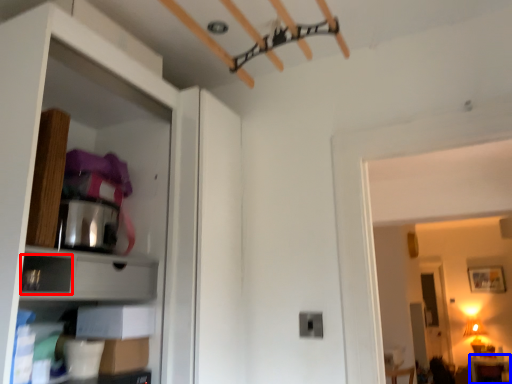
Question: Which point is closer to the camera, drawer (highlighted by a red box) or furniture (highlighted by a blue box)?

Choices:
 (A) drawer
 (B) furniture

Answer: (A)